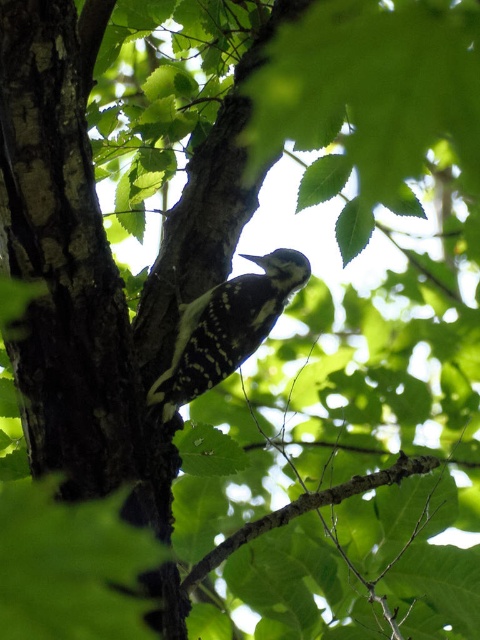
Question: Can you confirm if dark brown bark at center is positioned to the right of black and white speckled woodpecker at center?

Choices:
 (A) yes
 (B) no

Answer: (B)

Question: Is dark brown bark at center positioned before black and white speckled woodpecker at center?

Choices:
 (A) no
 (B) yes

Answer: (B)

Question: Can you confirm if dark brown bark at center is smaller than black and white speckled woodpecker at center?

Choices:
 (A) yes
 (B) no

Answer: (B)

Question: Which point is closer to the camera?

Choices:
 (A) dark brown bark at center
 (B) black and white speckled woodpecker at center

Answer: (A)

Question: Which of the following is the closest to the observer?

Choices:
 (A) black and white speckled woodpecker at center
 (B) dark brown bark at center

Answer: (B)